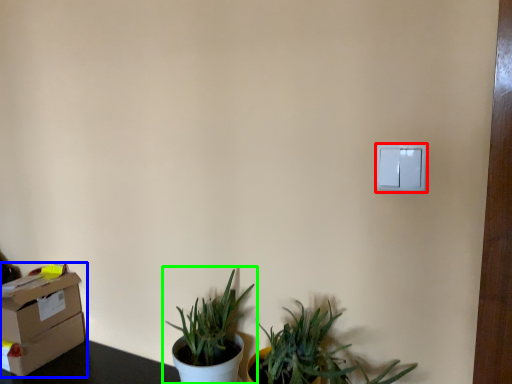
Question: Which object is positioned closest to light switch (highlighted by a red box)? Select from cardboard box (highlighted by a blue box) and houseplant (highlighted by a green box).

Choices:
 (A) cardboard box
 (B) houseplant

Answer: (B)